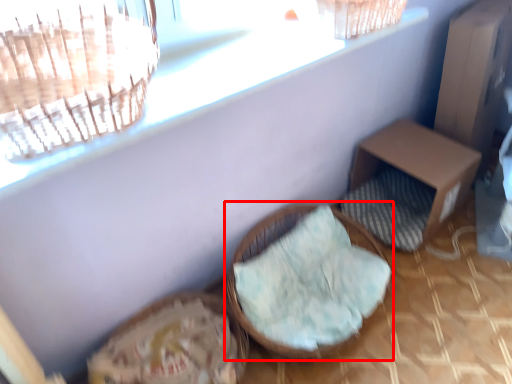
Question: From the image's perspective, where is furniture (annotated by the red box) located relative to furniture?

Choices:
 (A) above
 (B) below

Answer: (B)